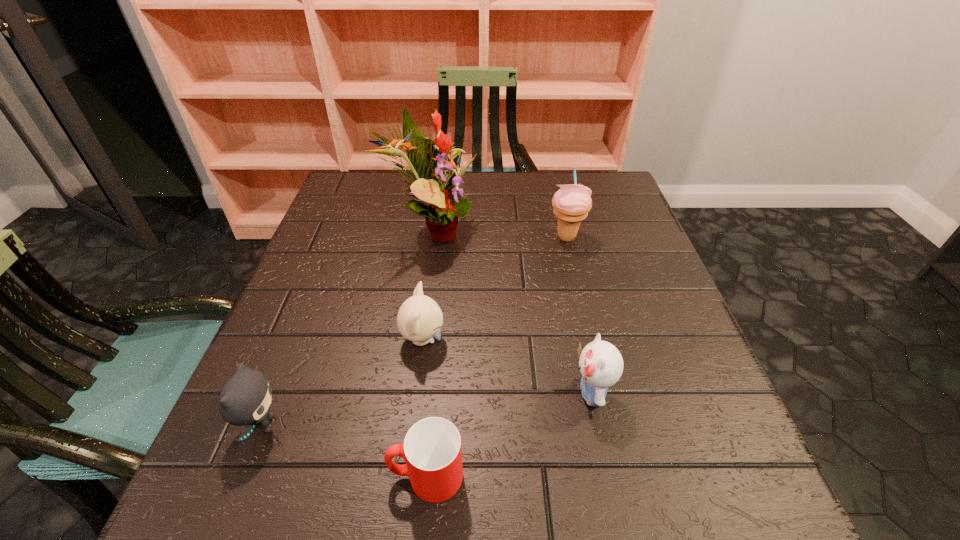
Identify the location of free spot located on the front-facing side of the rightmost kitten. The width and height of the screenshot is (960, 540). (489, 393).

This screenshot has height=540, width=960. Find the location of `blank space located on the front-facing side of the rightmost kitten`. blank space located on the front-facing side of the rightmost kitten is located at coordinates (465, 393).

Locate an element on the screen. The height and width of the screenshot is (540, 960). free space located on the front-facing side of the leftmost kitten is located at coordinates (396, 425).

Identify the location of vacant space situated 0.190m on the face of the farthest kitten. (544, 340).

Locate an element on the screen. The image size is (960, 540). vacant area situated on the side of the cup with the handle is located at coordinates (355, 476).

Locate an element on the screen. free space located on the side of the cup with the handle is located at coordinates (328, 476).

Find the location of a particular element. vacant space located on the side of the cup with the handle is located at coordinates (280, 476).

The width and height of the screenshot is (960, 540). In order to click on object that is at the far edge in this screenshot , I will do 445,203.

At what (x,y) coordinates should I click in order to perform the action: click on object located at the near edge. Please return your answer as a coordinate pair (x, y). Looking at the image, I should click on (432, 450).

Locate an element on the screen. The image size is (960, 540). bouquet located at the left edge is located at coordinates (445, 203).